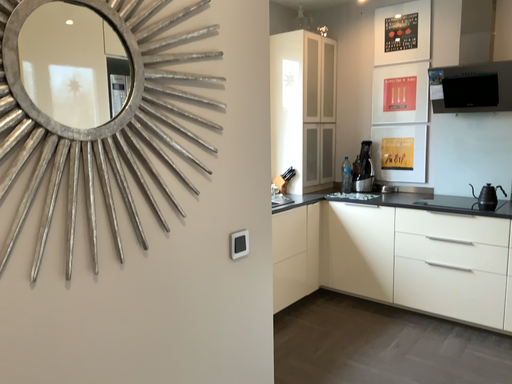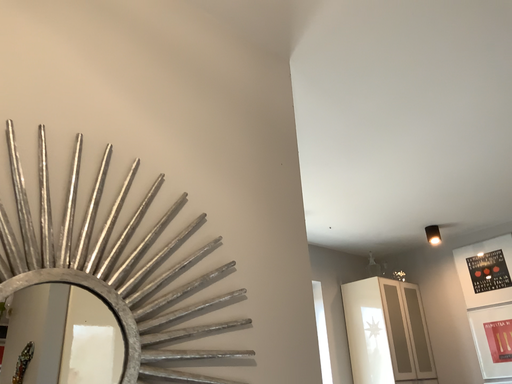
Question: Which way did the camera rotate in the video?

Choices:
 (A) rotated right
 (B) rotated left

Answer: (B)